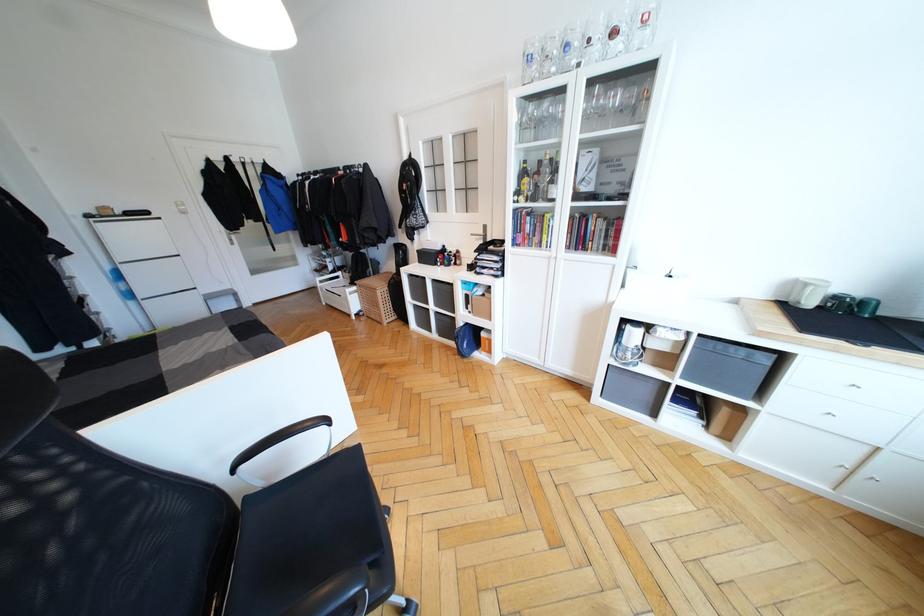
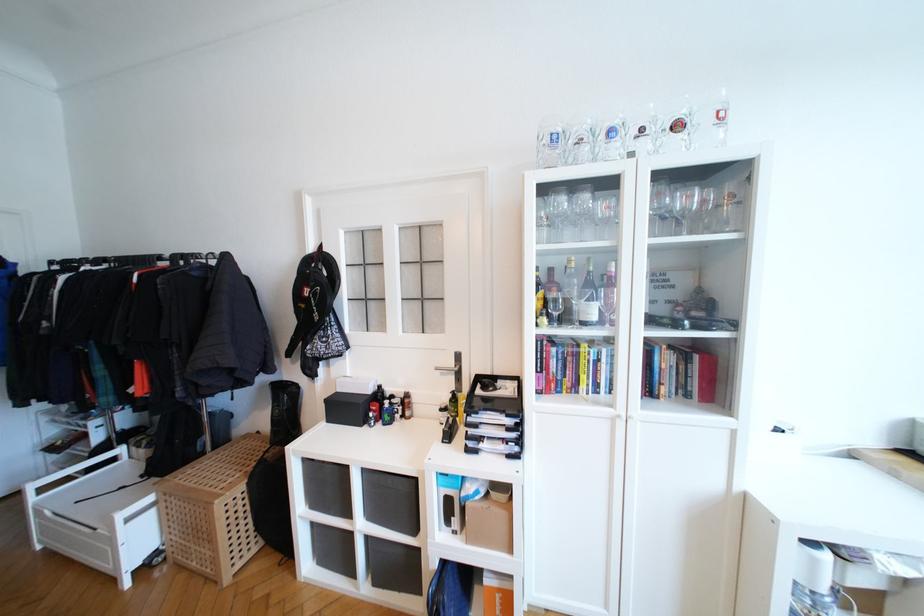
The point at (341, 278) is marked in the first image. Where is the corresponding point in the second image?

(116, 461)